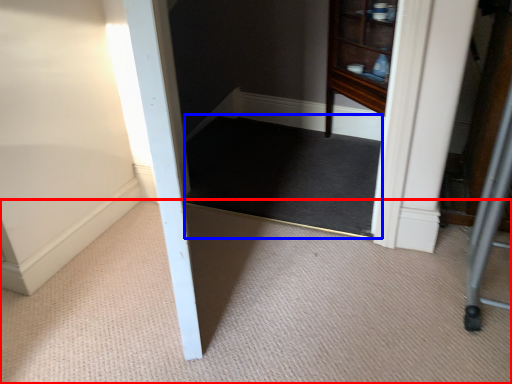
Question: Which object is closer to the camera taking this photo, plain (highlighted by a red box) or mat (highlighted by a blue box)?

Choices:
 (A) plain
 (B) mat

Answer: (A)